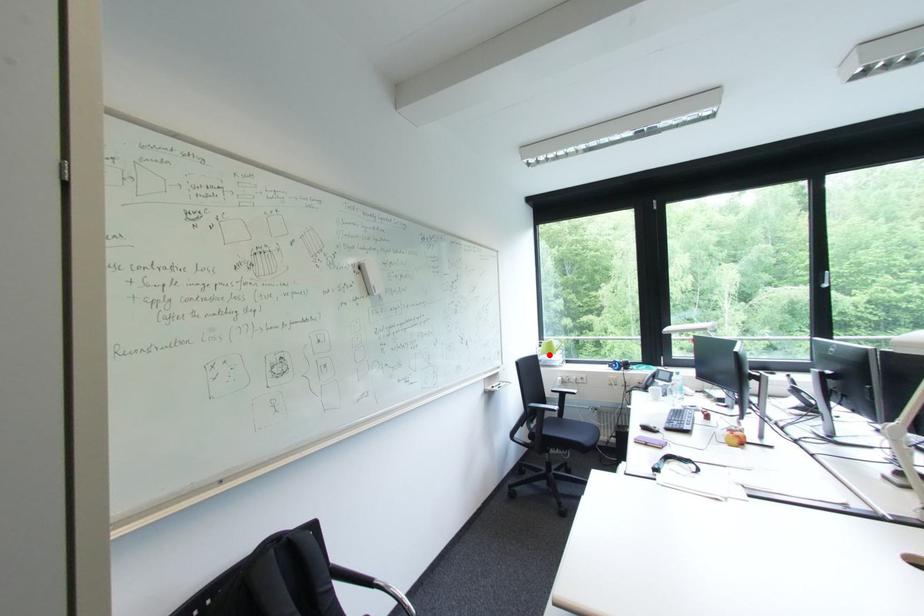
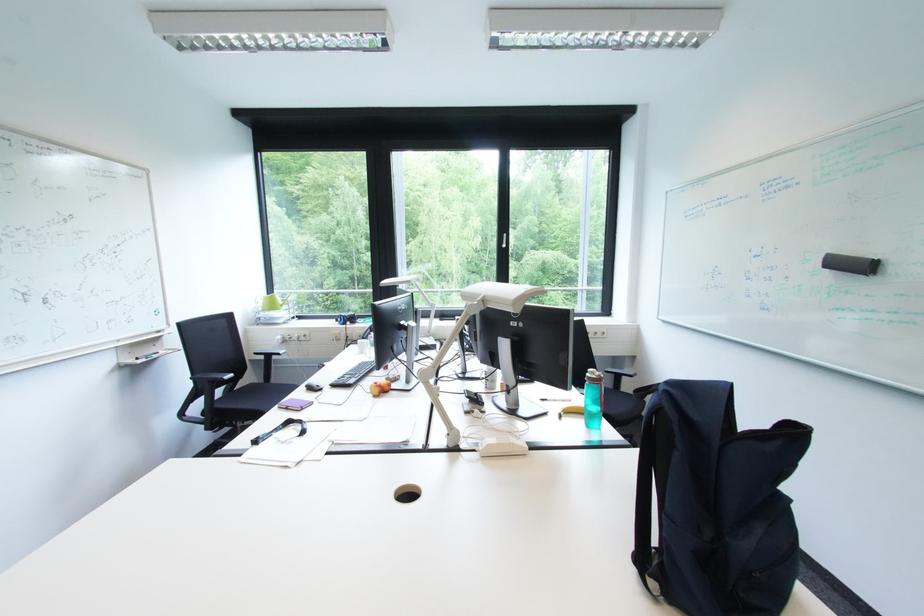
Question: I am providing you with two images of the same scene from different viewpoints. In image1, a red point is highlighted. Considering the same 3D point in image2, which of the following is correct?

Choices:
 (A) It is closer
 (B) It is farther

Answer: (A)